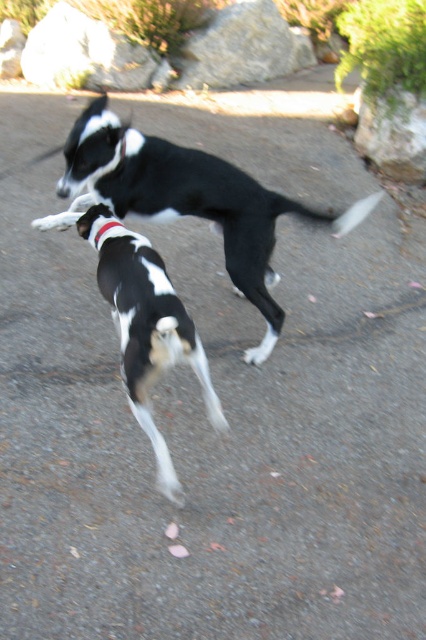
What are the coordinates of the black and white fur dog at center?

The coordinates of the black and white fur dog at center are at point (187, 200).

You are a photographer trying to capture a clear image of both the black and white fur dog at center and the red fabric neckband at center. Based on their sizes, which one might require you to adjust your camera settings to ensure it is in focus?

The black and white fur dog at center might require adjusting the camera settings because it is wider than the red fabric neckband at center, so focusing on the larger object might be necessary for clarity.

You are a photographer aiming to capture a clear photo of both the black and white fur at center and the red fabric neckband at center. Given that your camera has a depth of field that can sharply focus on objects within a 20 inch range, will both subjects be in focus simultaneously?

The distance between the black and white fur at center and the red fabric neckband at center is 21.80 inches, which exceeds the camera lens depth of field range of 20 inches. Therefore, both subjects cannot be in focus at the same time.